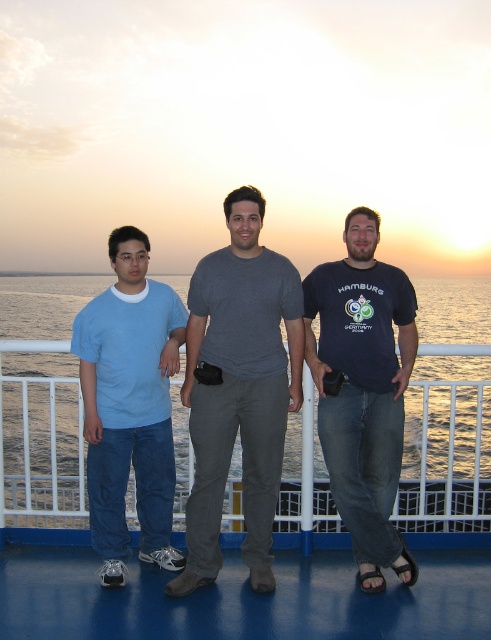
You are standing on the deck of a ferry and want to take a photo of two specific points marked in the scene. The first point is at coordinates point (x=25, y=304) and the second is at point (x=137, y=509). Which point is closer to you, the photographer?

Point (x=25, y=304) is closer to you since it is further to the viewer than point (x=137, y=509).